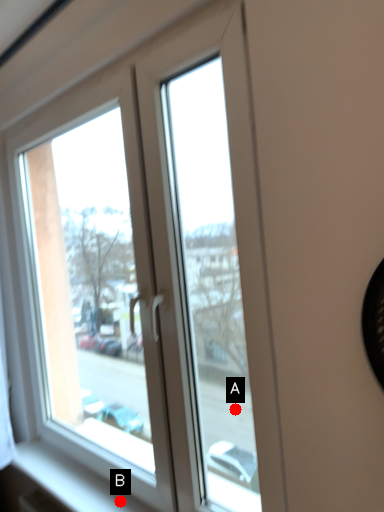
Question: Two points are circled on the image, labeled by A and B beside each circle. Which point appears farthest from the camera in this image?

Choices:
 (A) A is further
 (B) B is further

Answer: (A)